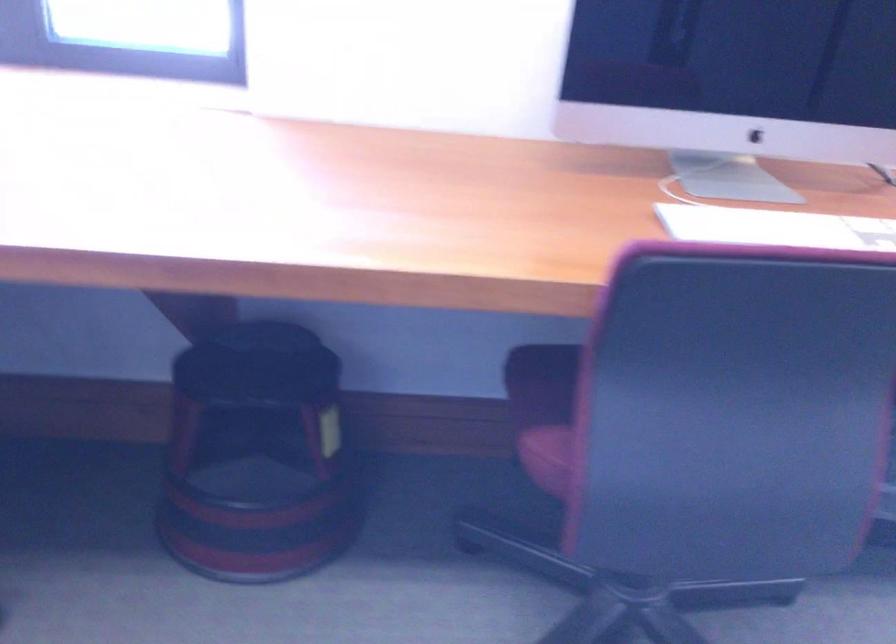
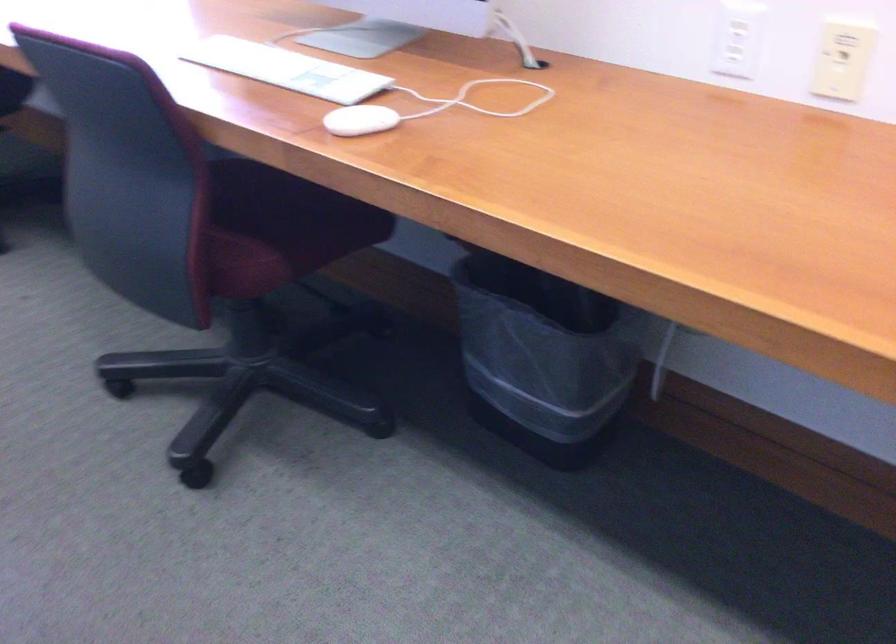
Find the pixel in the second image that matches pixel 780 410 in the first image.

(273, 228)